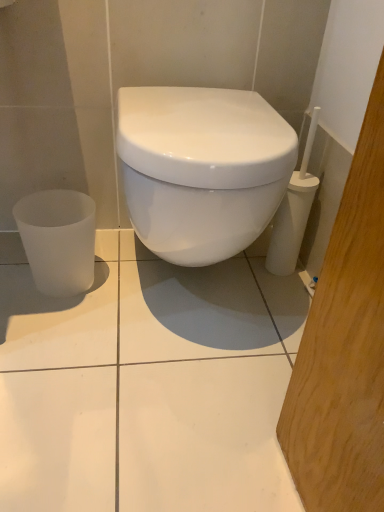
Image resolution: width=384 pixels, height=512 pixels. I want to click on free space underneath white glossy toilet at center (from a real-world perspective), so click(x=203, y=300).